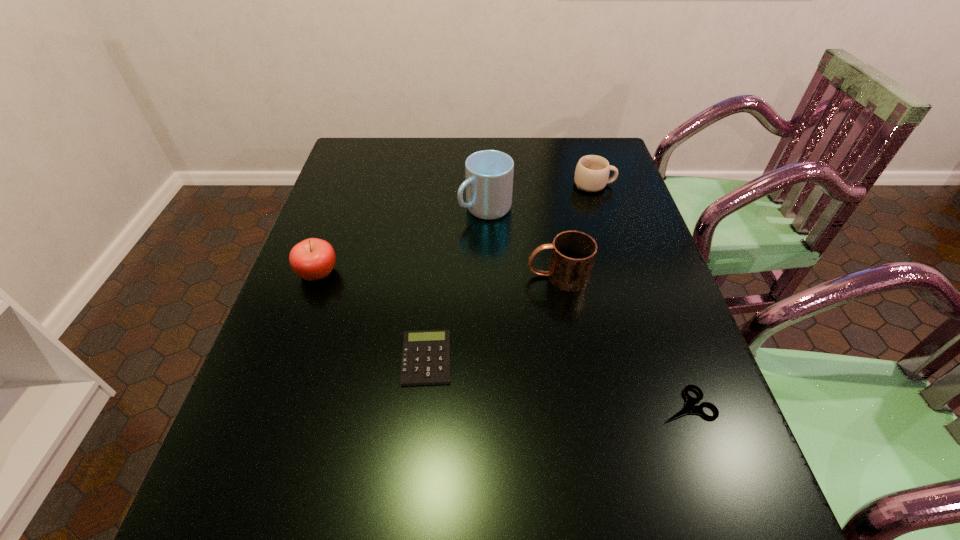
Find the location of a particular element. Image resolution: width=960 pixels, height=540 pixels. the shortest object is located at coordinates [x=690, y=407].

Find the location of a particular element. free space located 0.280m on the left of the tallest mug is located at coordinates coord(364,208).

Identify the location of blank space located 0.350m on the side of the nearest mug with the handle. (387, 276).

The image size is (960, 540). Find the location of `free region located 0.230m on the side of the nearest mug with the handle`. free region located 0.230m on the side of the nearest mug with the handle is located at coordinates (435, 276).

In order to click on free space located 0.390m on the side of the nearest mug with the handle in this screenshot , I will do `click(371, 276)`.

Where is `free space located on the back of the leftmost object`? This screenshot has height=540, width=960. free space located on the back of the leftmost object is located at coordinates (334, 226).

Locate an element on the screen. This screenshot has height=540, width=960. vacant region located 0.140m on the front of the second nearest object is located at coordinates (417, 456).

You are a GUI agent. You are given a task and a screenshot of the screen. Output one action in this format:
    pyautogui.click(x=<x>, y=<y>)
    Task: Click on the free spot located on the back of the shortest object
    The width and height of the screenshot is (960, 540).
    Given the screenshot: What is the action you would take?
    pyautogui.click(x=667, y=349)

In order to click on object present at the far edge in this screenshot , I will do `click(592, 172)`.

The height and width of the screenshot is (540, 960). What are the coordinates of `object located at the left edge` in the screenshot? It's located at (312, 259).